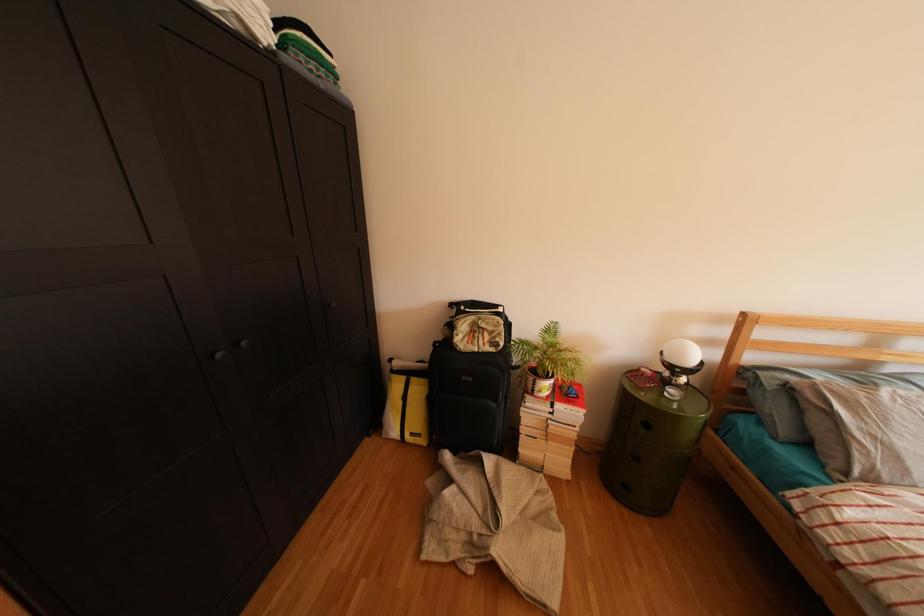
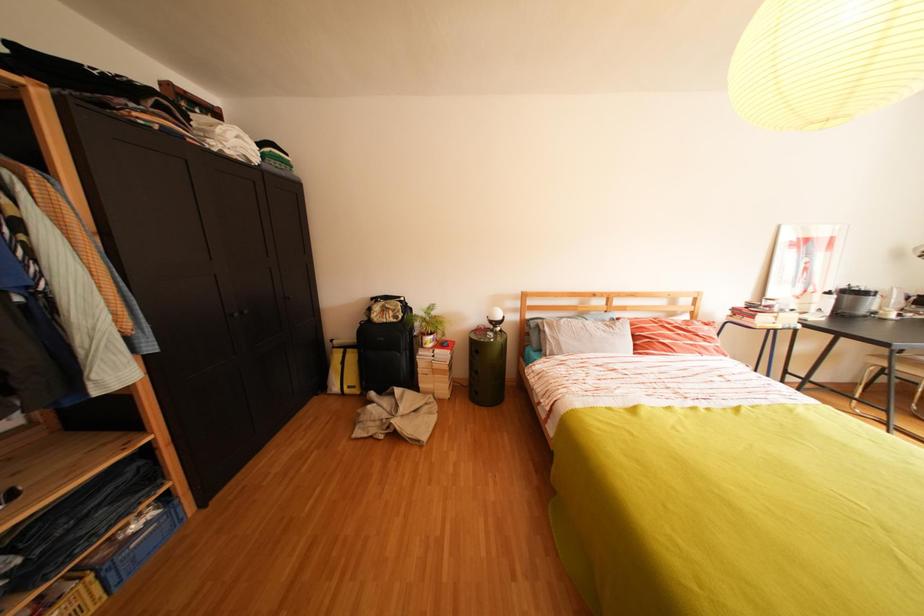
Which direction would the cameraman need to move to produce the second image?

The movement direction of the cameraman is right, backward.